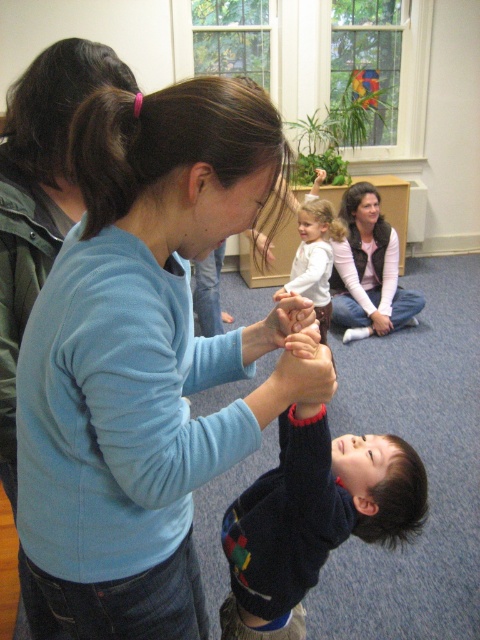
You are a photographer setting up a shoot in this room. You need to place a small light source to the right of the white soft shirt at center to highlight it. Considering the position of the matte pink sweater at upper right, where should you place the light source?

The matte pink sweater at upper right is positioned on the right side of the white soft shirt at center. Therefore, placing the light source to the right of the white soft shirt at center would position it next to the matte pink sweater at upper right, which may also illuminate both items.

You are organizing a clothing drive and need to sort sweaters by size. You have a dark blue sweater at center and a matte pink sweater at upper right. Which sweater should you place in the large size bin?

The dark blue sweater at center should be placed in the large size bin because it is bigger than the matte pink sweater at upper right.